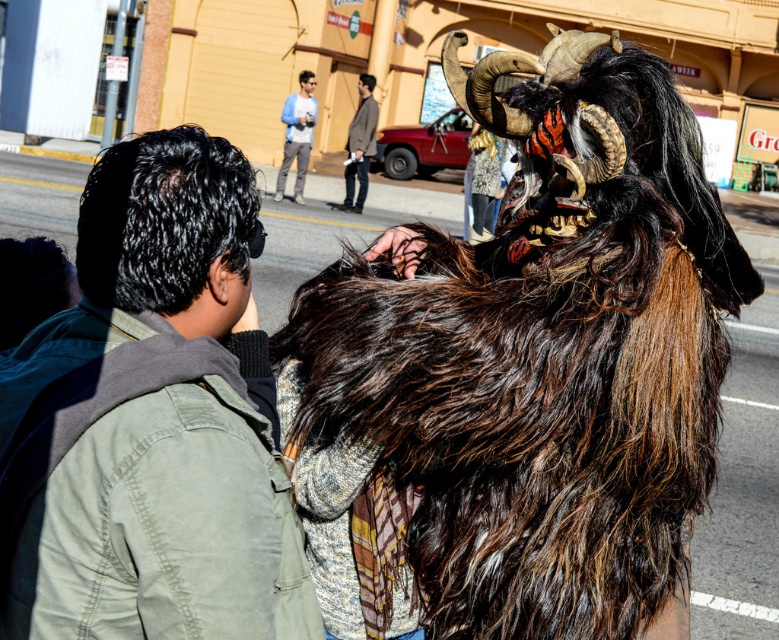
Question: Can you confirm if furry brown mask at center is positioned to the right of green fabric jacket at center?

Choices:
 (A) yes
 (B) no

Answer: (A)

Question: Does furry brown mask at center have a smaller size compared to blue denim jeans at upper center?

Choices:
 (A) yes
 (B) no

Answer: (A)

Question: Among these points, which one is farthest from the camera?

Choices:
 (A) (365, 152)
 (B) (344, 573)

Answer: (A)

Question: Can you confirm if green fabric jacket at center is bigger than light brown leather jacket at center?

Choices:
 (A) yes
 (B) no

Answer: (B)

Question: Which point appears farthest from the camera in this image?

Choices:
 (A) click(145, 244)
 (B) click(395, 336)

Answer: (B)

Question: Which point appears closest to the camera in this image?

Choices:
 (A) (735, 275)
 (B) (301, 106)
 (C) (355, 198)
 (D) (57, 627)

Answer: (D)